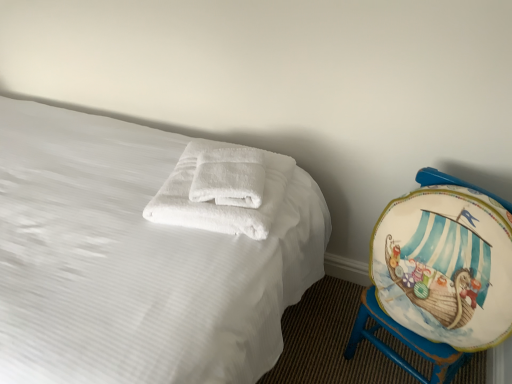
Describe the element at coordinates (134, 261) in the screenshot. I see `white soft towel at center` at that location.

You are a GUI agent. You are given a task and a screenshot of the screen. Output one action in this format:
    pyautogui.click(x=<x>, y=<y>)
    Task: Click on the white soft towel at center
    The image size is (512, 384).
    Given the screenshot: What is the action you would take?
    pyautogui.click(x=134, y=261)

Image resolution: width=512 pixels, height=384 pixels. What do you see at coordinates (407, 345) in the screenshot?
I see `painted wood globe at right` at bounding box center [407, 345].

What are the coordinates of `white soft towel at center` in the screenshot? It's located at (134, 261).

Measure the distance between white soft towel at center and white soft towel at center.

white soft towel at center and white soft towel at center are 11.84 inches apart from each other.

Is the depth of white soft towel at center greater than that of white soft towel at center?

Yes, it is.

This screenshot has width=512, height=384. I want to click on bed located in front of the white soft towel at center, so click(x=134, y=261).

Is white soft towel at center at the right side of white soft towel at center?

Indeed, white soft towel at center is positioned on the right side of white soft towel at center.

Which object is closer to the camera, white soft towel at center or white fluffy towels at center?

Positioned in front is white fluffy towels at center.

Between white soft towel at center and white fluffy towels at center, which one appears on the left side from the viewer's perspective?

white fluffy towels at center.

Which object is wider, white soft towel at center or white fluffy towels at center?

white fluffy towels at center is wider.

From the image's perspective, is white soft towel at center located beneath white fluffy towels at center?

No, from the image's perspective, white soft towel at center is not beneath white fluffy towels at center.

Is painted wood globe at right looking in the opposite direction of white fluffy towels at center?

That's not correct — painted wood globe at right is not looking away from white fluffy towels at center.

From the image's perspective, is painted wood globe at right under white fluffy towels at center?

Correct, painted wood globe at right appears lower than white fluffy towels at center in the image.

Does point (387, 356) appear closer or farther from the camera than point (220, 214)?

Point (387, 356) is positioned farther from the camera compared to point (220, 214).

How different are the orientations of painted wood globe at right and white fluffy towels at center in degrees?

The angular difference between painted wood globe at right and white fluffy towels at center is 129 degrees.

Can you confirm if painted wood globe at right is smaller than white soft towel at center?

Correct, painted wood globe at right occupies less space than white soft towel at center.

Between painted wood globe at right and white soft towel at center, which one is positioned behind?

painted wood globe at right.

Between painted wood globe at right and white soft towel at center, which one has smaller width?

With smaller width is painted wood globe at right.

Is painted wood globe at right touching white soft towel at center?

No.

Consider the image. From a real-world perspective, relative to white soft towel at center, is white fluffy towels at center vertically above or below?

Clearly, from a real-world perspective, white fluffy towels at center is above white soft towel at center.

From the picture: Is white fluffy towels at center turned away from white soft towel at center?

Correct, white fluffy towels at center is looking away from white soft towel at center.

Where is `towel on the right of the white soft towel at center`? The height and width of the screenshot is (384, 512). towel on the right of the white soft towel at center is located at coordinates (212, 202).

Does white fluffy towels at center have a greater width compared to white soft towel at center?

In fact, white fluffy towels at center might be narrower than white soft towel at center.

Is point (250, 155) closer or farther from the camera than point (426, 354)?

Point (250, 155) is positioned farther from the camera compared to point (426, 354).

Is white soft towel at center shorter than painted wood globe at right?

Yes, white soft towel at center is shorter than painted wood globe at right.

Where is `towel on the left of painted wood globe at right`? This screenshot has width=512, height=384. towel on the left of painted wood globe at right is located at coordinates (212, 202).

Is there a large distance between white fluffy towels at center and painted wood globe at right?

That's not correct — white fluffy towels at center is a little close to painted wood globe at right.

Would you say painted wood globe at right is part of white fluffy towels at center's contents?

No, painted wood globe at right is not a part of white fluffy towels at center.

Considering the sizes of objects white fluffy towels at center and painted wood globe at right in the image provided, who is bigger, white fluffy towels at center or painted wood globe at right?

Bigger between the two is painted wood globe at right.

Identify the location of bed that is below the white soft towel at center (from the image's perspective). The height and width of the screenshot is (384, 512). (134, 261).

Identify the location of towel below the white soft towel at center (from a real-world perspective). Image resolution: width=512 pixels, height=384 pixels. (212, 202).

Which object lies nearer to the anchor point white fluffy towels at center, white soft towel at center or painted wood globe at right?

Based on the image, white soft towel at center appears to be nearer to white fluffy towels at center.

Based on their spatial positions, is painted wood globe at right or white soft towel at center further from white fluffy towels at center?

painted wood globe at right lies further to white fluffy towels at center than the other object.

Estimate the real-world distances between objects in this image. Which object is closer to white soft towel at center, white soft towel at center or painted wood globe at right?

Based on the image, white soft towel at center appears to be nearer to white soft towel at center.

Considering their positions, is white soft towel at center positioned closer to painted wood globe at right than white fluffy towels at center?

white fluffy towels at center is closer to painted wood globe at right.

Looking at the image, which one is located further to white soft towel at center, painted wood globe at right or white soft towel at center?

Based on the image, painted wood globe at right appears to be further to white soft towel at center.

When comparing their distances from white fluffy towels at center, does white soft towel at center or white soft towel at center seem closer?

white soft towel at center lies closer to white fluffy towels at center than the other object.

Looking at the image, which one is located further to painted wood globe at right, white soft towel at center or white fluffy towels at center?

The object further to painted wood globe at right is white soft towel at center.

When comparing their distances from white soft towel at center, does white soft towel at center or white fluffy towels at center seem closer?

Based on the image, white fluffy towels at center appears to be nearer to white soft towel at center.

At what (x,y) coordinates should I click in order to perform the action: click on towel situated between white soft towel at center and white soft towel at center from left to right. Please return your answer as a coordinate pair (x, y). Looking at the image, I should click on (212, 202).

Find the location of a particular element. towel between white soft towel at center and painted wood globe at right in the horizontal direction is located at coordinates (212, 202).

Where is `bath towel between white soft towel at center and painted wood globe at right in the horizontal direction`? The width and height of the screenshot is (512, 384). bath towel between white soft towel at center and painted wood globe at right in the horizontal direction is located at coordinates (229, 177).

Where is `bath towel between white fluffy towels at center and painted wood globe at right`? The height and width of the screenshot is (384, 512). bath towel between white fluffy towels at center and painted wood globe at right is located at coordinates (229, 177).